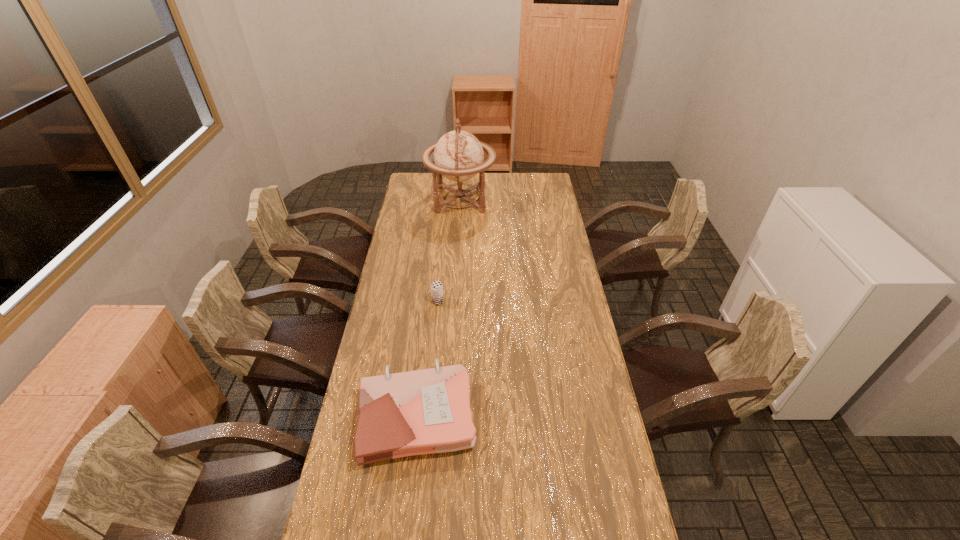
In order to click on object at the far left corner in this screenshot , I will do coord(458,155).

Find the location of a particular element. This screenshot has height=540, width=960. vacant space at the left edge of the desktop is located at coordinates (390, 284).

At what (x,y) coordinates should I click in order to perform the action: click on vacant region at the right edge of the desktop. Please return your answer as a coordinate pair (x, y). The width and height of the screenshot is (960, 540). Looking at the image, I should click on (579, 366).

Locate an element on the screen. vacant space at the far right corner of the desktop is located at coordinates (532, 180).

You are a GUI agent. You are given a task and a screenshot of the screen. Output one action in this format:
    pyautogui.click(x=<x>, y=<y>)
    Task: Click on the blank region between the beer can and the globe
    
    Given the screenshot: What is the action you would take?
    pyautogui.click(x=449, y=251)

The image size is (960, 540). What are the coordinates of `vacant area that lies between the farthest object and the beer can` in the screenshot? It's located at (449, 251).

Locate an element on the screen. blank region between the beer can and the globe is located at coordinates (449, 251).

Locate an element on the screen. This screenshot has width=960, height=540. empty space between the phonebook and the beer can is located at coordinates (427, 358).

Image resolution: width=960 pixels, height=540 pixels. I want to click on free space between the tallest object and the phonebook, so click(439, 307).

Image resolution: width=960 pixels, height=540 pixels. Find the location of `object that stands as the closest to the farthest object`. object that stands as the closest to the farthest object is located at coordinates (437, 295).